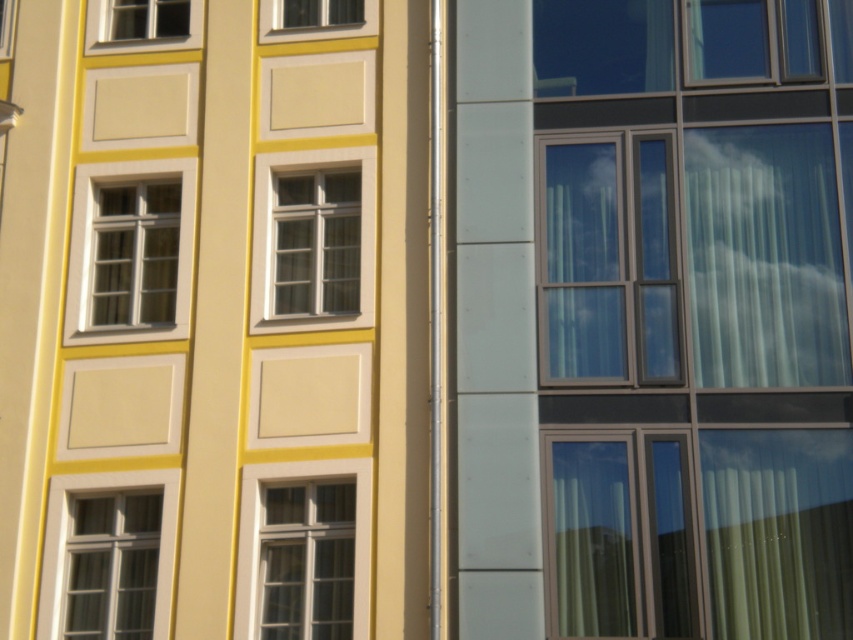
You are standing in front of the modern building on the right. You see a matte white window at center. Where is the matte white window at center located in relation to the point marked as point [315,243]?

The matte white window at center is located at the point marked as point [315,243].

You are standing in front of two architectural facades. You notice two points marked on them. The first point is at coordinate point (155,541) and the second is at point (317,22). Which of these two points is closer to your current position?

Point (155,541) is closer to the viewer than point (317,22).

You are an architect evaluating the spatial arrangement of the modern building facade. You notice two matte white windows. Which one is closer to the observer, the matte white window at center or the matte white window at upper left?

The matte white window at center is closer to the observer because it is positioned in front of the matte white window at upper left.